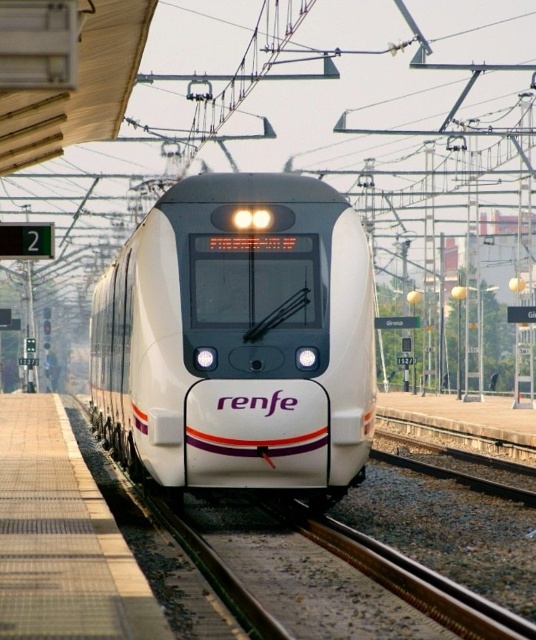
You are standing on the platform and want to board the white glossy train at center. Which direction should you walk to reach it from the smooth concrete platform at lower left?

The white glossy train at center is further to the viewer than the smooth concrete platform at lower left, so you should walk towards the train along the platform towards it.

You are a passenger waiting at the station. You see the white glossy train at center and the smooth concrete platform at lower left. Which one is located above the other?

The white glossy train at center is positioned over the smooth concrete platform at lower left, so the train is above the platform.